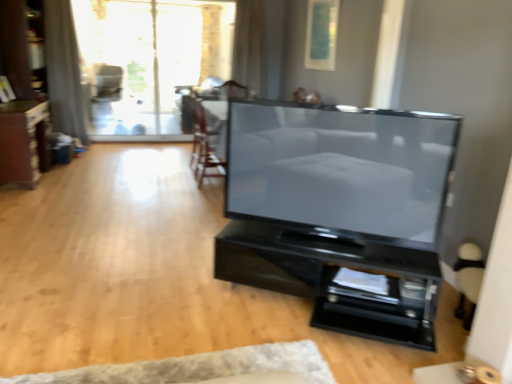
Question: From the image's perspective, relative to dark brown wood dresser at left, is gray fabric curtain at upper left, which appears as the 1th curtain when viewed from the left, above or below?

Choices:
 (A) below
 (B) above

Answer: (B)

Question: Considering the positions of gray fabric curtain at upper left, which appears as the 1th curtain when viewed from the left, and dark brown wood dresser at left in the image, is gray fabric curtain at upper left, which appears as the 1th curtain when viewed from the left, bigger or smaller than dark brown wood dresser at left?

Choices:
 (A) big
 (B) small

Answer: (B)

Question: Which of these objects is positioned closest to the white textured rug at lower center?

Choices:
 (A) matte black tv at center
 (B) gray fabric curtain at upper left, placed as the second curtain when sorted from right to left
 (C) white sheer curtain at upper center, which is the 1th curtain in right-to-left order
 (D) matte black armchair at upper center, positioned as the second armchair in bottom-to-top order
 (E) black glossy tv stand at center, the 2th furniture viewed from the back

Answer: (E)

Question: Based on their relative distances, which object is farther from the gray fabric curtain at upper left, placed as the second curtain when sorted from right to left?

Choices:
 (A) matte black tv at center
 (B) matte brown cabinet at left, which ranks as the second furniture in right-to-left order
 (C) white sheer curtain at upper center, which is the 1th curtain in right-to-left order
 (D) transparent glass door at upper center
 (E) dark brown wood dresser at left

Answer: (A)